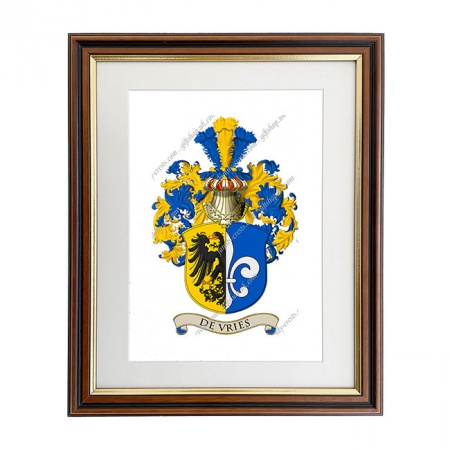
Locate an element on the screen. This screenshot has width=450, height=450. artwork is located at coordinates (261, 274).